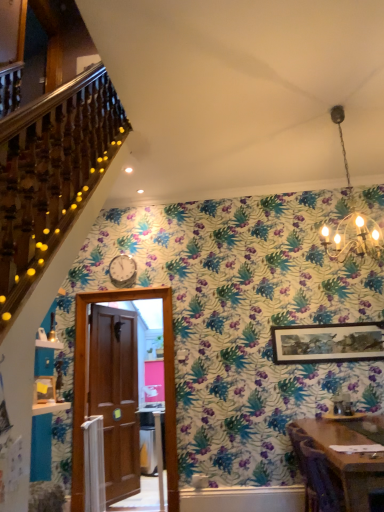
Question: Is the depth of wooden table at lower right less than that of wooden framed artwork at upper right?

Choices:
 (A) yes
 (B) no

Answer: (A)

Question: Considering the relative sizes of wooden table at lower right and wooden framed artwork at upper right in the image provided, is wooden table at lower right bigger than wooden framed artwork at upper right?

Choices:
 (A) yes
 (B) no

Answer: (A)

Question: Can you confirm if wooden table at lower right is positioned to the right of wooden framed artwork at upper right?

Choices:
 (A) yes
 (B) no

Answer: (B)

Question: Does wooden table at lower right have a greater width compared to wooden framed artwork at upper right?

Choices:
 (A) yes
 (B) no

Answer: (A)

Question: Can you confirm if wooden table at lower right is taller than wooden framed artwork at upper right?

Choices:
 (A) yes
 (B) no

Answer: (A)

Question: Is wooden table at lower right located outside wooden framed artwork at upper right?

Choices:
 (A) no
 (B) yes

Answer: (B)

Question: Considering the relative sizes of wooden framed artwork at upper right and brown wooden door at center in the image provided, is wooden framed artwork at upper right thinner than brown wooden door at center?

Choices:
 (A) yes
 (B) no

Answer: (A)

Question: Does wooden framed artwork at upper right appear on the right side of brown wooden door at center?

Choices:
 (A) yes
 (B) no

Answer: (A)

Question: Is wooden framed artwork at upper right outside brown wooden door at center?

Choices:
 (A) no
 (B) yes

Answer: (B)

Question: From the image's perspective, is wooden framed artwork at upper right over brown wooden door at center?

Choices:
 (A) no
 (B) yes

Answer: (B)

Question: Is wooden framed artwork at upper right facing away from brown wooden door at center?

Choices:
 (A) yes
 (B) no

Answer: (B)

Question: Can you confirm if wooden framed artwork at upper right is positioned to the left of brown wooden door at center?

Choices:
 (A) no
 (B) yes

Answer: (A)

Question: Is wooden table at lower right not close to brown wooden door at center?

Choices:
 (A) yes
 (B) no

Answer: (A)